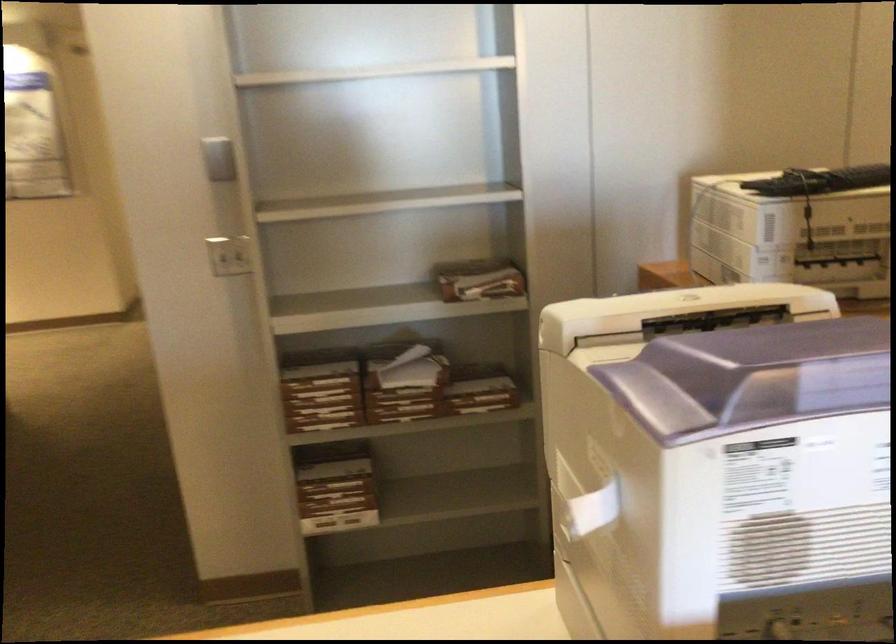
Where would you typ the black computer keyboard? Please return your answer as a coordinate pair (x, y).

(820, 181)